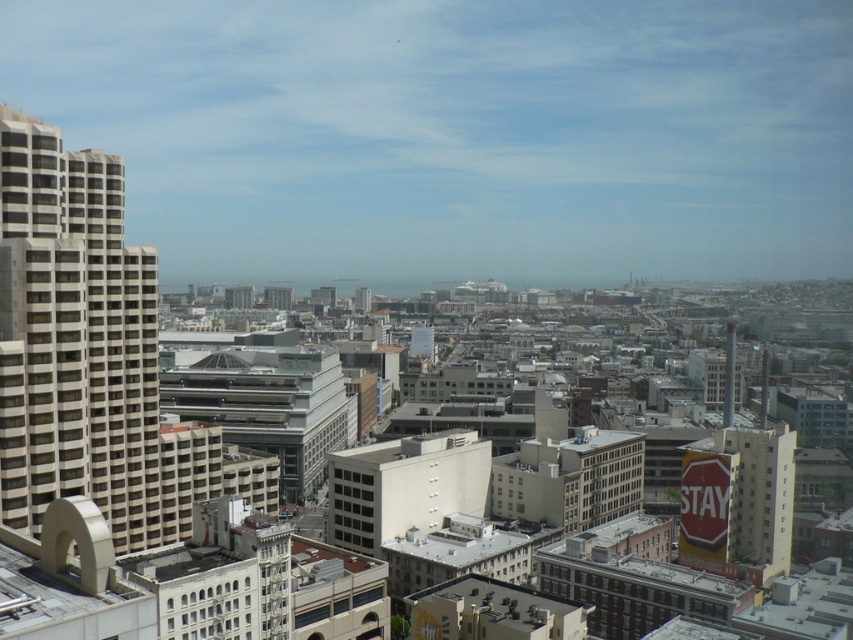
Question: Is beige concrete building at left to the left of red matte stop sign at center-right from the viewer's perspective?

Choices:
 (A) yes
 (B) no

Answer: (A)

Question: Is beige concrete building at left positioned before red matte stop sign at center-right?

Choices:
 (A) no
 (B) yes

Answer: (B)

Question: Which of the following is the closest to the observer?

Choices:
 (A) (691, 467)
 (B) (13, 454)

Answer: (B)

Question: Which point is closer to the camera?

Choices:
 (A) beige concrete building at left
 (B) red matte stop sign at center-right

Answer: (A)

Question: Can you confirm if beige concrete building at left is smaller than red matte stop sign at center-right?

Choices:
 (A) no
 (B) yes

Answer: (A)

Question: Among these points, which one is nearest to the camera?

Choices:
 (A) (7, 506)
 (B) (688, 524)

Answer: (A)